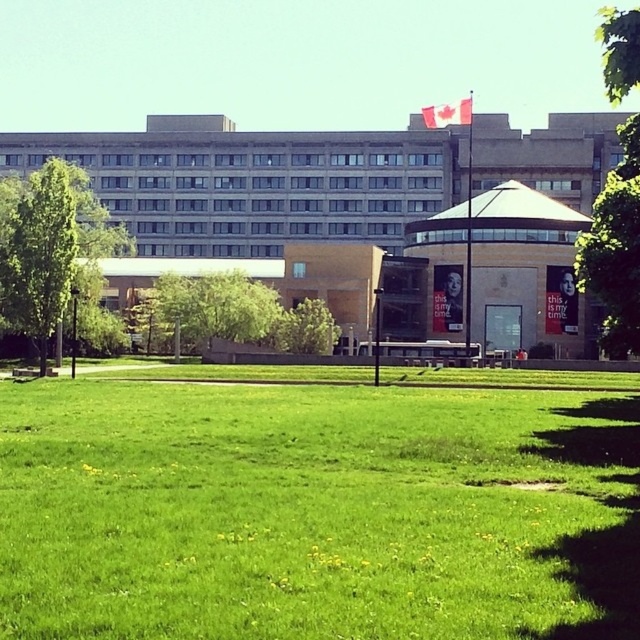
You are standing 5 meters away from the green grass at center. Can you reach it without moving closer?

The green grass at center is 6.12 meters away from the viewer. Since you are currently 5 meters away, you are already closer than the required distance, so you can reach it without needing to move closer.

Consider the image. You are a landscape architect designing a walking path between the green leafy tree at left and the green leafy tree at center. Based on their positions, which tree should the path start closer to the left side of the scene?

The path should start closer to the green leafy tree at left since it is positioned to the left of the green leafy tree at center.

You are a landscape architect evaluating the site. You need to determine which tree, the green leafy tree at left or the green leafy tree at center, would cast a larger shadow during midday. Based on their heights, which tree would cast a larger shadow?

The green leafy tree at left is much taller than the green leafy tree at center, so it would cast a larger shadow during midday.